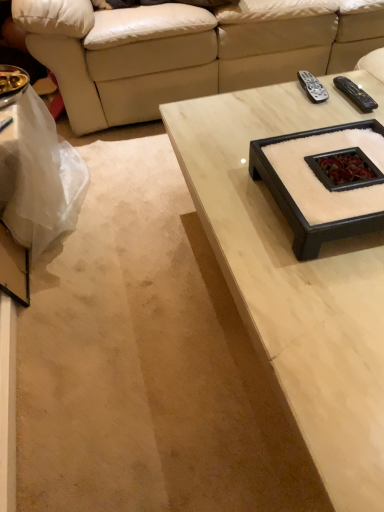
This screenshot has height=512, width=384. I want to click on vacant area that lies to the right of white plastic bag at lower left, so click(x=128, y=204).